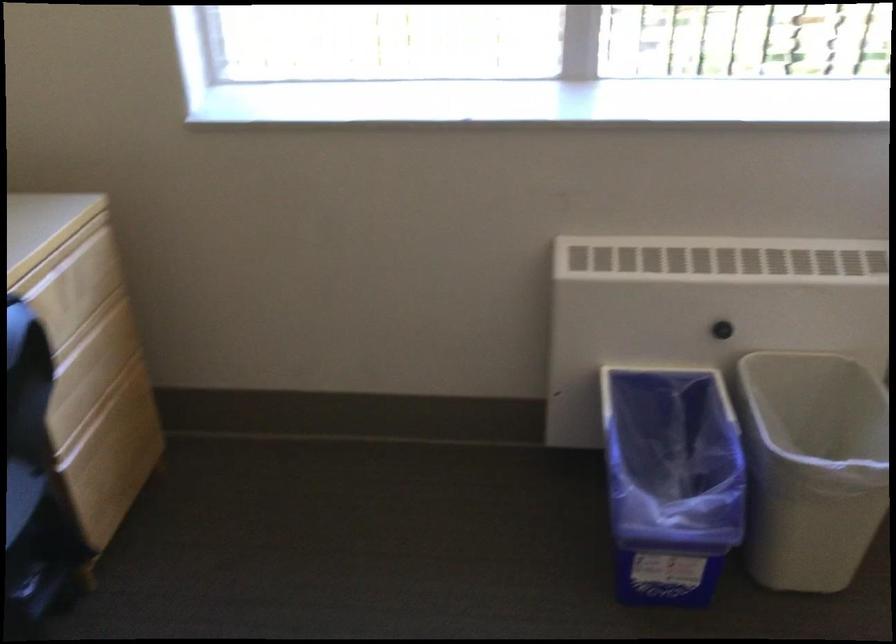
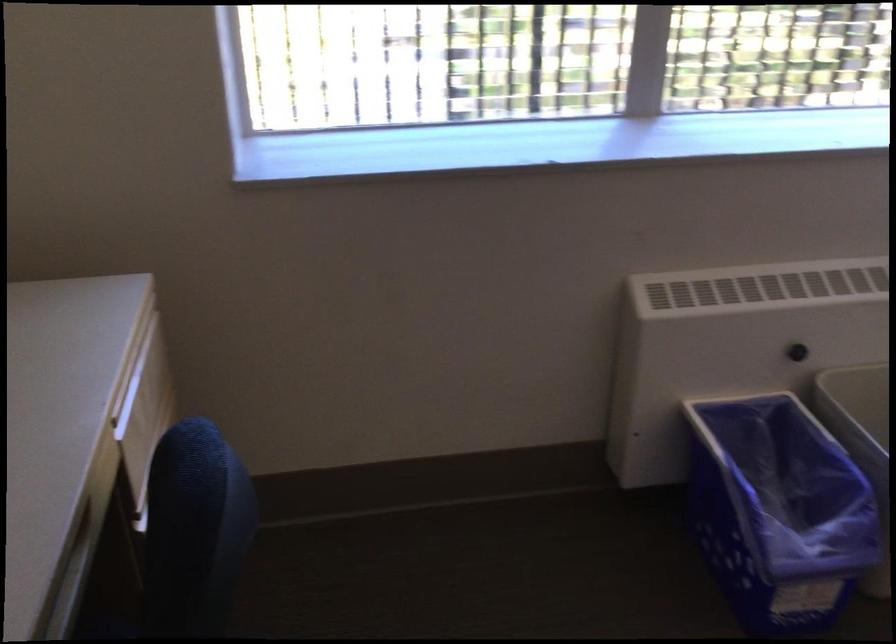
Where in the second image is the point corresponding to the point at 797,380 from the first image?

(860, 391)